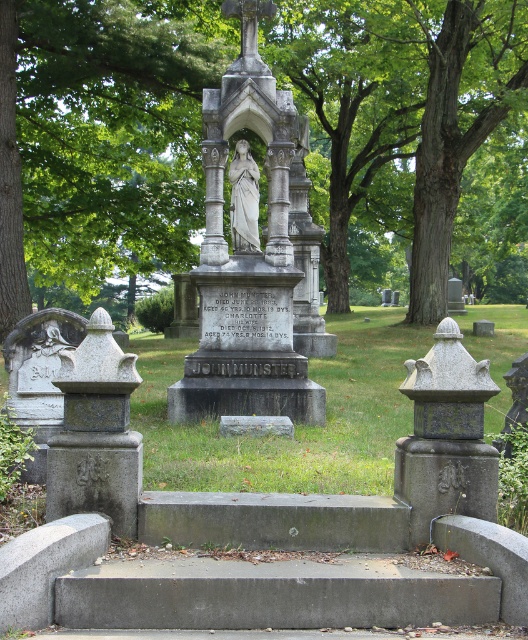
Is green leafy tree at center shorter than polished stone statue at center?

No, green leafy tree at center is not shorter than polished stone statue at center.

Does point (99, 232) lie in front of point (241, 413)?

No, it is not.

Where is `green leafy tree at center`? green leafy tree at center is located at coordinates (92, 131).

Which of these two, polished stone statue at center or white marble statue at center, stands taller?

Standing taller between the two is polished stone statue at center.

Which of these two, polished stone statue at center or white marble statue at center, stands shorter?

white marble statue at center

Image resolution: width=528 pixels, height=640 pixels. Describe the element at coordinates (250, 256) in the screenshot. I see `polished stone statue at center` at that location.

At what (x,y) coordinates should I click in order to perform the action: click on polished stone statue at center. Please return your answer as a coordinate pair (x, y). Image resolution: width=528 pixels, height=640 pixels. Looking at the image, I should click on (250, 256).

Is green leafy tree at center thinner than white marble statue at center?

Incorrect, green leafy tree at center's width is not less than white marble statue at center's.

Is green leafy tree at center wider than white marble statue at center?

Yes, green leafy tree at center is wider than white marble statue at center.

Find the location of a particular element. This screenshot has width=528, height=640. green leafy tree at center is located at coordinates (92, 131).

Image resolution: width=528 pixels, height=640 pixels. In order to click on green leafy tree at center in this screenshot , I will do `click(92, 131)`.